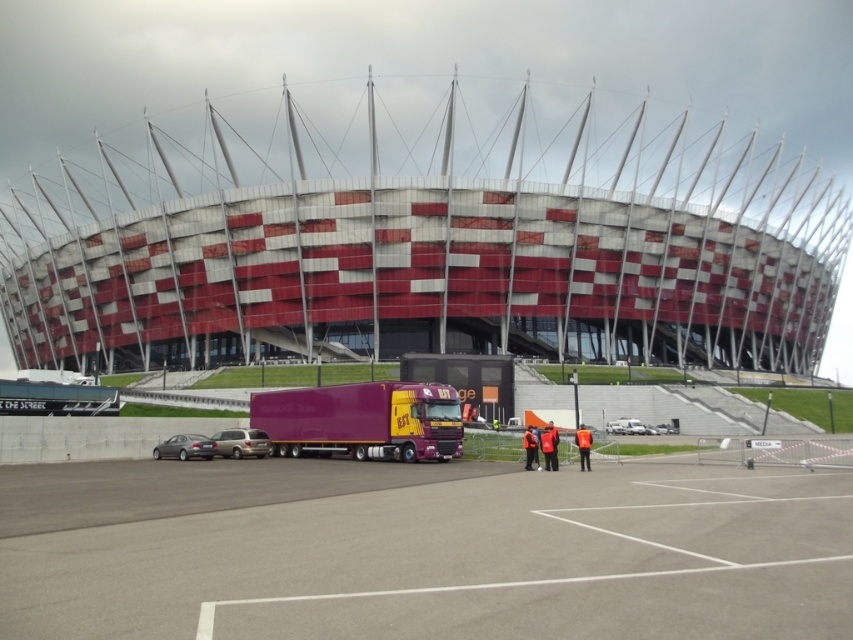
Question: Which of these objects is positioned closest to the silver metallic sedan at lower left?

Choices:
 (A) purple glossy trailer truck at center
 (B) white matte van at lower right

Answer: (A)

Question: Considering the real-world distances, which object is farthest from the silver metallic sedan at lower left?

Choices:
 (A) silver metallic car at center
 (B) white matte van at lower right
 (C) purple glossy trailer truck at center

Answer: (B)

Question: Can you confirm if purple glossy trailer truck at center is wider than white matte van at lower right?

Choices:
 (A) no
 (B) yes

Answer: (B)

Question: Which point is farther to the camera?

Choices:
 (A) (241, 445)
 (B) (207, 440)
 (C) (425, 401)

Answer: (B)

Question: Is purple glossy trailer truck at center bigger than silver metallic car at center?

Choices:
 (A) yes
 (B) no

Answer: (A)

Question: Can you confirm if purple glossy trailer truck at center is wider than silver metallic car at center?

Choices:
 (A) no
 (B) yes

Answer: (B)